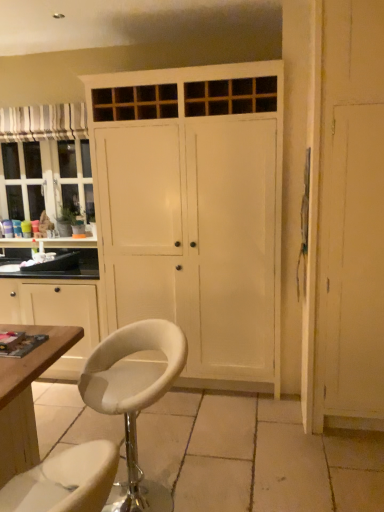
The image size is (384, 512). Describe the element at coordinates (351, 268) in the screenshot. I see `wooden screen door at right` at that location.

What do you see at coordinates (134, 399) in the screenshot? I see `white leather stool at center` at bounding box center [134, 399].

Find the location of `striped fabric curtain at upper left`. striped fabric curtain at upper left is located at coordinates (43, 123).

This screenshot has height=512, width=384. I want to click on wooden cabinet at left, so click(x=56, y=316).

Consider the image. What's the angular difference between striped fabric curtain at upper left and white painted wood cupboard at center's facing directions?

They differ by 0.541 degrees in their facing directions.

Is striped fabric curtain at upper left closer to the viewer compared to white painted wood cupboard at center?

No, it is behind white painted wood cupboard at center.

Which is correct: striped fabric curtain at upper left is inside white painted wood cupboard at center, or outside of it?

striped fabric curtain at upper left is spatially situated outside white painted wood cupboard at center.

Can you confirm if white painted wood cupboard at center is bigger than striped fabric curtain at upper left?

Yes.

Considering the points (185, 188) and (17, 120), which point is in front, point (185, 188) or point (17, 120)?

The point (185, 188) is closer to the camera.

Is white leather stool at center facing towards wooden cabinet at left?

No, white leather stool at center does not turn towards wooden cabinet at left.

Which object is further away from the camera taking this photo, white leather stool at center or wooden cabinet at left?

wooden cabinet at left is more distant.

Is wooden cabinet at left located within white leather stool at center?

No, wooden cabinet at left is located outside of white leather stool at center.

Is white leather stool at center with wooden cabinet at left?

white leather stool at center and wooden cabinet at left are clearly separated.

Is striped fabric curtain at upper left beside white leather stool at center?

No.

From the image's perspective, relative to white leather stool at center, is striped fabric curtain at upper left above or below?

Based on their image positions, striped fabric curtain at upper left is located above white leather stool at center.

From a real-world perspective, is striped fabric curtain at upper left positioned under white leather stool at center based on gravity?

Incorrect, from a real-world perspective, striped fabric curtain at upper left is higher than white leather stool at center.

Can you confirm if striped fabric curtain at upper left is wider than white leather stool at center?

No.

Considering the positions of points (338, 336) and (97, 284), is point (338, 336) closer to camera compared to point (97, 284)?

That is True.

From the image's perspective, is wooden screen door at right over wooden cabinet at left?

Yes, from the image's perspective, wooden screen door at right is over wooden cabinet at left.

Is wooden cabinet at left surrounded by wooden screen door at right?

Definitely not — wooden cabinet at left is not inside wooden screen door at right.

In the image, is wooden screen door at right positioned in front of or behind wooden cabinet at left?

wooden screen door at right is in front of wooden cabinet at left.

Which point is more distant from viewer, (70, 290) or (170, 342)?

Positioned behind is point (70, 290).

Considering the sizes of wooden cabinet at left and white leather stool at center in the image, is wooden cabinet at left wider or thinner than white leather stool at center?

wooden cabinet at left is wider than white leather stool at center.

Which object is further away from the camera, wooden cabinet at left or white leather stool at center?

wooden cabinet at left is more distant.

From the image's perspective, is wooden cabinet at left above or below white leather stool at center?

Based on their image positions, wooden cabinet at left is located above white leather stool at center.

Is white painted wood cupboard at center located within wooden screen door at right?

No, white painted wood cupboard at center is located outside of wooden screen door at right.

Is wooden screen door at right behind white painted wood cupboard at center?

No, wooden screen door at right is closer to the viewer.

Consider the image. From the image's perspective, is wooden screen door at right above or below white painted wood cupboard at center?

wooden screen door at right is below white painted wood cupboard at center.

Which object is positioned more to the left, wooden screen door at right or white painted wood cupboard at center?

Positioned to the left is white painted wood cupboard at center.

Where is `cupboard in front of the striped fabric curtain at upper left`? The image size is (384, 512). cupboard in front of the striped fabric curtain at upper left is located at coordinates (194, 209).

At what (x,y) coordinates should I click in order to perform the action: click on cupboard below the striped fabric curtain at upper left (from a real-world perspective). Please return your answer as a coordinate pair (x, y). This screenshot has height=512, width=384. Looking at the image, I should click on (194, 209).

Based on their spatial positions, is wooden screen door at right or white painted wood cupboard at center further from wooden cabinet at left?

wooden screen door at right is further to wooden cabinet at left.

Considering their positions, is wooden cabinet at left positioned closer to striped fabric curtain at upper left than white leather stool at center?

Among the two, wooden cabinet at left is located nearer to striped fabric curtain at upper left.

From the picture: Based on their spatial positions, is striped fabric curtain at upper left or white leather stool at center closer to wooden cabinet at left?

The object closer to wooden cabinet at left is white leather stool at center.

From the image, which object appears to be nearer to striped fabric curtain at upper left, wooden cabinet at left or wooden screen door at right?

wooden cabinet at left.

When comparing their distances from wooden screen door at right, does wooden cabinet at left or white leather stool at center seem further?

Among the two, wooden cabinet at left is located further to wooden screen door at right.

Which object lies further to the anchor point wooden screen door at right, wooden cabinet at left or striped fabric curtain at upper left?

striped fabric curtain at upper left is further to wooden screen door at right.

Which object lies further to the anchor point white painted wood cupboard at center, striped fabric curtain at upper left or wooden cabinet at left?

striped fabric curtain at upper left lies further to white painted wood cupboard at center than the other object.

From the image, which object appears to be nearer to wooden cabinet at left, white leather stool at center or white painted wood cupboard at center?

The object closer to wooden cabinet at left is white painted wood cupboard at center.

Where is `cupboard between striped fabric curtain at upper left and wooden cabinet at left in the vertical direction`? This screenshot has width=384, height=512. cupboard between striped fabric curtain at upper left and wooden cabinet at left in the vertical direction is located at coordinates (194, 209).

Image resolution: width=384 pixels, height=512 pixels. In order to click on chair situated between wooden cabinet at left and wooden screen door at right from left to right in this screenshot , I will do `click(134, 399)`.

Identify the location of cabinetry between striped fabric curtain at upper left and white leather stool at center in the vertical direction. (56, 316).

I want to click on curtain between wooden cabinet at left and wooden screen door at right, so tap(43, 123).